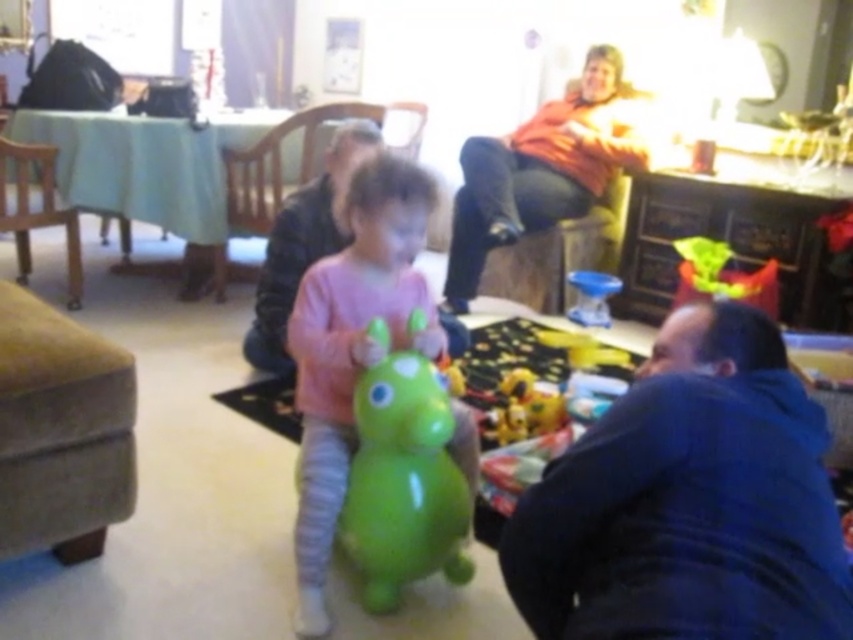
Question: Which of the following is the farthest from the observer?

Choices:
 (A) (683, 516)
 (B) (527, 372)
 (C) (357, 417)
 (D) (579, 285)

Answer: (D)

Question: Which of the following is the closest to the observer?

Choices:
 (A) (49, 316)
 (B) (228, 211)

Answer: (A)

Question: Is blue cotton shirt at lower right to the left of green rubber toy at center from the viewer's perspective?

Choices:
 (A) yes
 (B) no

Answer: (B)

Question: Is blue cotton shirt at lower right to the right of blue plastic toy at center from the viewer's perspective?

Choices:
 (A) no
 (B) yes

Answer: (A)

Question: Does rubber duck at lower center have a smaller size compared to blue plastic toy at center?

Choices:
 (A) yes
 (B) no

Answer: (A)

Question: Which point is farther to the camera?

Choices:
 (A) brown wooden chair at left
 (B) orange soft sweater at upper right
 (C) matte wood armchair at center
 (D) rubber green toy at center

Answer: (B)